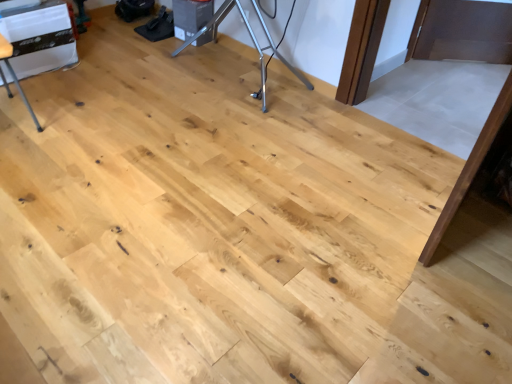
Find the location of a particular element. Image resolution: width=512 pixels, height=384 pixels. free spot behind matte white appliance at left is located at coordinates (45, 92).